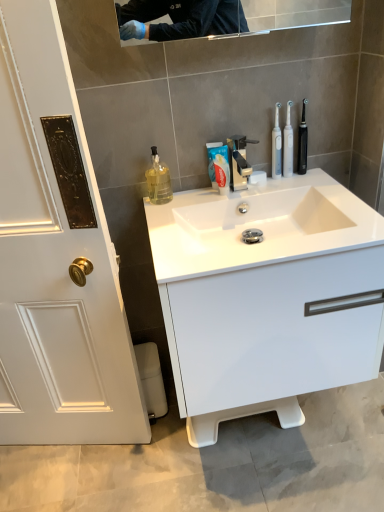
This screenshot has width=384, height=512. In order to click on free location to the left of white glossy toothpaste at center in this screenshot , I will do `click(181, 202)`.